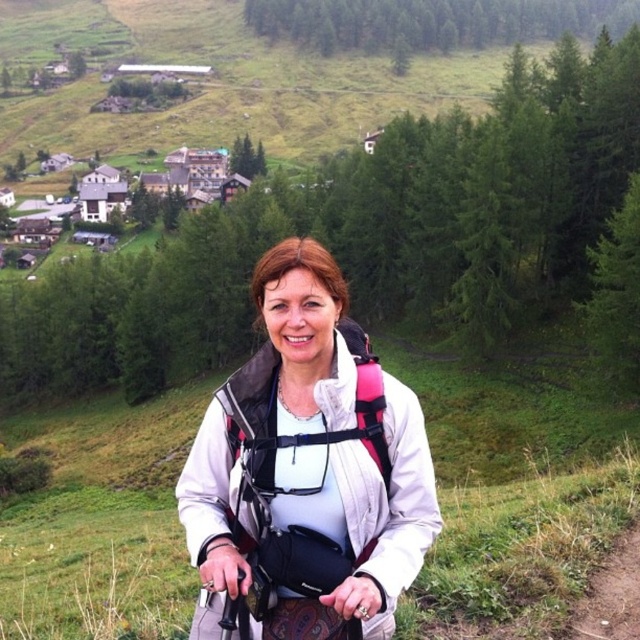
Does white matte jacket at center appear on the right side of pink fabric strap at center?

Incorrect, white matte jacket at center is not on the right side of pink fabric strap at center.

Does white matte jacket at center come behind pink fabric strap at center?

No, white matte jacket at center is closer to the viewer.

Which is behind, point (218, 426) or point (321, 472)?

The point (218, 426) is behind.

Where is `white matte jacket at center`? Image resolution: width=640 pixels, height=640 pixels. white matte jacket at center is located at coordinates (307, 472).